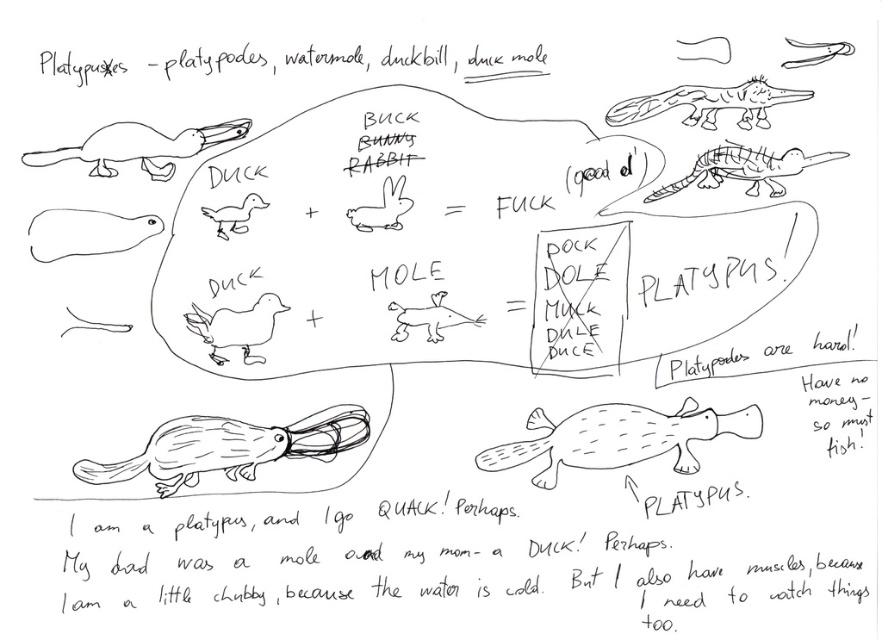
Question: Which of the following is the farthest from the observer?

Choices:
 (A) (193, 320)
 (B) (251, 208)
 (C) (655, 433)
 (D) (101, 163)

Answer: (C)

Question: Which of these objects is positioned farthest from the matte yellow duck at center?

Choices:
 (A) matte black platypus at left
 (B) gray textured platypus at center

Answer: (B)

Question: Is the position of matte yellow duck at center more distant than that of matte black duck at upper center?

Choices:
 (A) yes
 (B) no

Answer: (B)

Question: Is matte yellow duck at center smaller than brown furry mole at center?

Choices:
 (A) no
 (B) yes

Answer: (A)

Question: Is brown furry mole at center below smooth black beak at upper right?

Choices:
 (A) yes
 (B) no

Answer: (A)

Question: Among these points, which one is nearest to the camera?

Choices:
 (A) (233, 125)
 (B) (842, 52)
 (C) (40, 244)

Answer: (B)